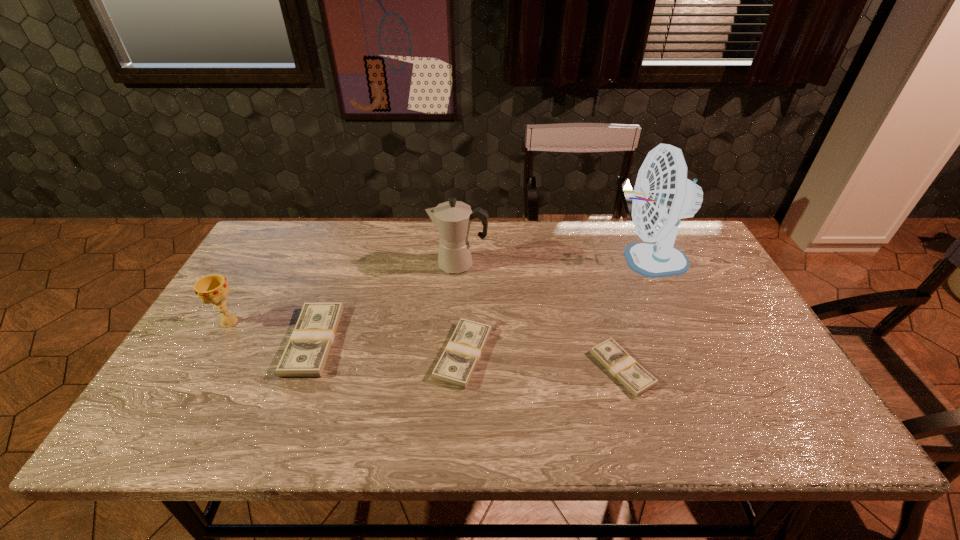
In order to click on empty space between the coffeepot and the leftmost object in this screenshot , I will do `click(344, 293)`.

Find the location of a particular element. free spot between the shortest dollar and the second tallest dollar is located at coordinates (542, 361).

The image size is (960, 540). In order to click on free space between the fan and the shortest dollar in this screenshot , I will do `click(634, 314)`.

At what (x,y) coordinates should I click in order to perform the action: click on free space between the chalice and the second shortest object. Please return your answer as a coordinate pair (x, y). This screenshot has width=960, height=540. Looking at the image, I should click on click(347, 338).

Image resolution: width=960 pixels, height=540 pixels. I want to click on vacant area that lies between the tallest object and the second shortest object, so click(x=554, y=307).

The image size is (960, 540). In order to click on vacant region between the leftmost dollar and the chalice in this screenshot , I will do `click(272, 331)`.

Locate an element on the screen. vacant region between the shortest dollar and the fan is located at coordinates (634, 314).

Select which object appears as the fourth closest to the tallest object. Please provide its 2D coordinates. Your answer should be formatted as a tuple, i.e. [(x, y)], where the tuple contains the x and y coordinates of a point satisfying the conditions above.

[(306, 354)]

Locate an element on the screen. The height and width of the screenshot is (540, 960). the fourth closest object relative to the second tallest dollar is located at coordinates click(662, 195).

Identify which dollar is located as the nearest to the leftmost object. Please provide its 2D coordinates. Your answer should be formatted as a tuple, i.e. [(x, y)], where the tuple contains the x and y coordinates of a point satisfying the conditions above.

[(306, 354)]